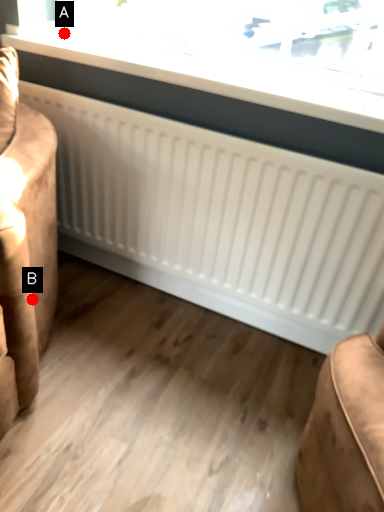
Question: Two points are circled on the image, labeled by A and B beside each circle. Which point is closer to the camera?

Choices:
 (A) A is closer
 (B) B is closer

Answer: (B)